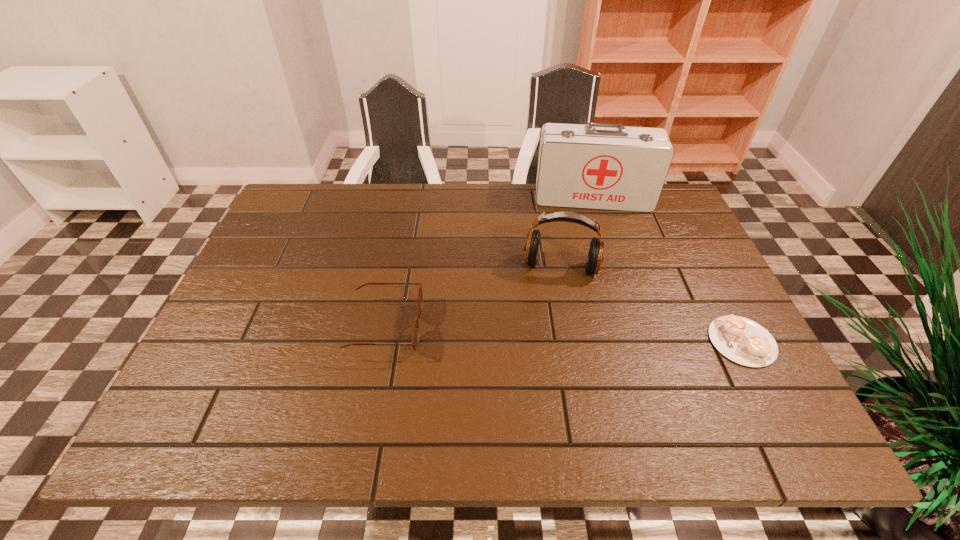
Locate an element on the screen. This screenshot has height=540, width=960. free point located on the front-facing side of the tallest object is located at coordinates [x=593, y=227].

Identify the location of free region located on the front-facing side of the tallest object. (602, 297).

At what (x,y) coordinates should I click in order to perform the action: click on vacant space located 0.170m on the ear cups of the third shortest object. Please return your answer as a coordinate pair (x, y). This screenshot has height=540, width=960. Looking at the image, I should click on (548, 335).

Locate an element on the screen. The height and width of the screenshot is (540, 960). free space located 0.100m on the ear cups of the third shortest object is located at coordinates (551, 312).

Where is `vacant space situated 0.090m on the ear cups of the third shortest object`? The width and height of the screenshot is (960, 540). vacant space situated 0.090m on the ear cups of the third shortest object is located at coordinates (552, 309).

Where is `object at the far edge`? The height and width of the screenshot is (540, 960). object at the far edge is located at coordinates (606, 166).

At what (x,y) coordinates should I click in order to perform the action: click on spectacles situated at the near edge. Please return your answer as a coordinate pair (x, y). This screenshot has width=960, height=540. Looking at the image, I should click on (415, 337).

Where is `cappuccino that is positioned at the near edge`? This screenshot has height=540, width=960. cappuccino that is positioned at the near edge is located at coordinates (741, 340).

At what (x,y) coordinates should I click in order to perform the action: click on cappuccino positioned at the right edge. Please return your answer as a coordinate pair (x, y). The image size is (960, 540). Looking at the image, I should click on (741, 340).

The height and width of the screenshot is (540, 960). In order to click on the first-aid kit at the right edge in this screenshot , I will do `click(606, 166)`.